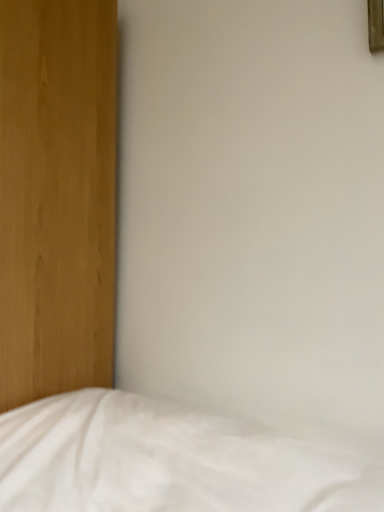
Where is `white soft bed at lower left`? Image resolution: width=384 pixels, height=512 pixels. white soft bed at lower left is located at coordinates (168, 461).

The width and height of the screenshot is (384, 512). Describe the element at coordinates (168, 461) in the screenshot. I see `white soft bed at lower left` at that location.

The width and height of the screenshot is (384, 512). Find the location of `wooden picture frame at upper right`. wooden picture frame at upper right is located at coordinates (376, 25).

The height and width of the screenshot is (512, 384). What do you see at coordinates (376, 25) in the screenshot?
I see `wooden picture frame at upper right` at bounding box center [376, 25].

Identify the location of white soft bed at lower left. The height and width of the screenshot is (512, 384). (168, 461).

Is white soft bed at lower left to the left or to the right of wooden picture frame at upper right in the image?

Clearly, white soft bed at lower left is on the left of wooden picture frame at upper right in the image.

Relative to wooden picture frame at upper right, is white soft bed at lower left in front or behind?

In the image, white soft bed at lower left appears in front of wooden picture frame at upper right.

Is point (100, 468) more distant than point (371, 17)?

No.

From the image's perspective, which is below, white soft bed at lower left or wooden picture frame at upper right?

white soft bed at lower left appears lower in the image.

From a real-world perspective, which object rests below the other?

white soft bed at lower left, from a real-world perspective.

Considering the relative sizes of white soft bed at lower left and wooden picture frame at upper right in the image provided, is white soft bed at lower left wider than wooden picture frame at upper right?

Yes, white soft bed at lower left is wider than wooden picture frame at upper right.

From their relative heights in the image, would you say white soft bed at lower left is taller or shorter than wooden picture frame at upper right?

Clearly, white soft bed at lower left is taller compared to wooden picture frame at upper right.

Between white soft bed at lower left and wooden picture frame at upper right, which one has larger size?

With larger size is white soft bed at lower left.

Could wooden picture frame at upper right be considered to be inside white soft bed at lower left?

That's incorrect, wooden picture frame at upper right is not inside white soft bed at lower left.

Is white soft bed at lower left with wooden picture frame at upper right?

There is a gap between white soft bed at lower left and wooden picture frame at upper right.

Does white soft bed at lower left turn towards wooden picture frame at upper right?

No, white soft bed at lower left is not turned towards wooden picture frame at upper right.

The height and width of the screenshot is (512, 384). I want to click on bed that appears below the wooden picture frame at upper right (from a real-world perspective), so click(168, 461).

Is wooden picture frame at upper right to the left of white soft bed at lower left from the viewer's perspective?

No, wooden picture frame at upper right is not to the left of white soft bed at lower left.

Relative to white soft bed at lower left, is wooden picture frame at upper right in front or behind?

Visually, wooden picture frame at upper right is located behind white soft bed at lower left.

Between point (380, 25) and point (3, 509), which one is positioned in front?

The point (3, 509) is more forward.

From the image's perspective, which one is positioned lower, wooden picture frame at upper right or white soft bed at lower left?

white soft bed at lower left, from the image's perspective.

From a real-world perspective, does wooden picture frame at upper right sit lower than white soft bed at lower left?

Incorrect, from a real-world perspective, wooden picture frame at upper right is higher than white soft bed at lower left.

Consider the image. Which object is thinner, wooden picture frame at upper right or white soft bed at lower left?

wooden picture frame at upper right.

Which of these two, wooden picture frame at upper right or white soft bed at lower left, stands taller?

Standing taller between the two is white soft bed at lower left.

Based on the photo, which of these two, wooden picture frame at upper right or white soft bed at lower left, is smaller?

wooden picture frame at upper right is smaller.

Would you say wooden picture frame at upper right is inside or outside white soft bed at lower left?

wooden picture frame at upper right is spatially situated outside white soft bed at lower left.

Based on the photo, is wooden picture frame at upper right placed right next to white soft bed at lower left?

wooden picture frame at upper right and white soft bed at lower left are not in contact.

Is white soft bed at lower left at the back of wooden picture frame at upper right?

wooden picture frame at upper right is not turned away from white soft bed at lower left.

What's the angular difference between wooden picture frame at upper right and white soft bed at lower left's facing directions?

wooden picture frame at upper right and white soft bed at lower left are facing 0.0669 degrees away from each other.

Where is `bed lying in front of the wooden picture frame at upper right`? This screenshot has height=512, width=384. bed lying in front of the wooden picture frame at upper right is located at coordinates (168, 461).

You are a GUI agent. You are given a task and a screenshot of the screen. Output one action in this format:
    pyautogui.click(x=<x>, y=<y>)
    Task: Click on the bed below the wooden picture frame at upper right (from the image's perspective)
    This screenshot has width=384, height=512.
    Given the screenshot: What is the action you would take?
    168,461

The height and width of the screenshot is (512, 384). Identify the location of bed on the left of the wooden picture frame at upper right. (168, 461).